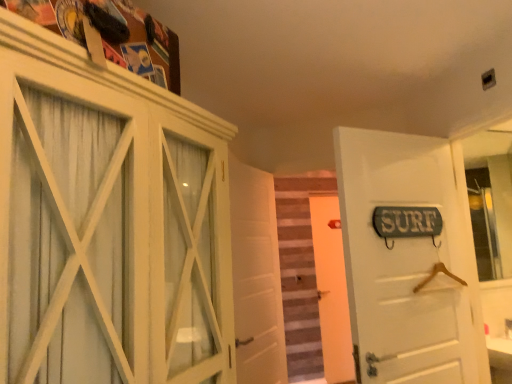
Question: From the image's perspective, is white wooden door at center, which is the 1th door in back-to-front order, located above or below wooden stairs at center?

Choices:
 (A) above
 (B) below

Answer: (B)

Question: Choose the correct answer: Is white wooden door at center, arranged as the third door when viewed from the front, inside wooden stairs at center or outside it?

Choices:
 (A) outside
 (B) inside

Answer: (A)

Question: Based on their relative distances, which object is nearer to the white matte door at center, the second door viewed from the back?

Choices:
 (A) white matte door at right, acting as the first door starting from the front
 (B) green painted wood surf sign at upper right
 (C) white wood cabinet at upper left
 (D) white wooden door at center, arranged as the third door when viewed from the front
 (E) wooden stairs at center

Answer: (A)

Question: Which of these objects is positioned farthest from the wooden stairs at center?

Choices:
 (A) white wooden door at center, arranged as the third door when viewed from the front
 (B) white matte door at right, positioned as the third door in back-to-front order
 (C) clear glass mirror at right
 (D) white wood cabinet at upper left
 (E) white matte door at center, the 2th door when ordered from front to back

Answer: (D)